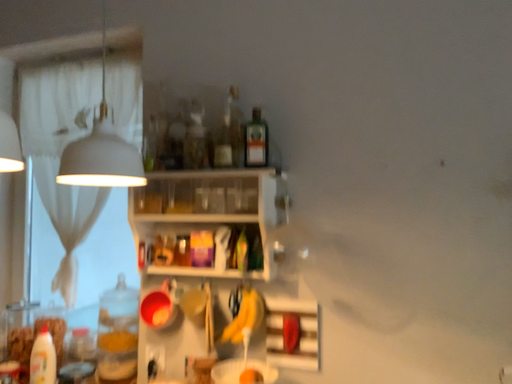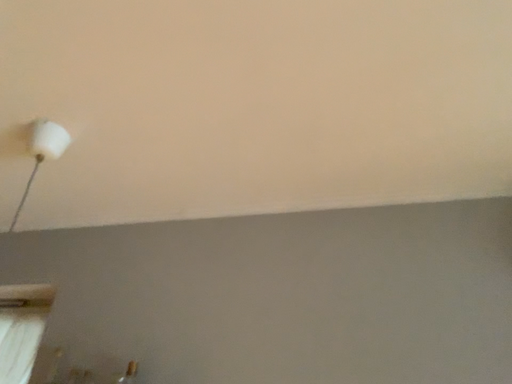
Question: How did the camera likely rotate when shooting the video?

Choices:
 (A) rotated downward
 (B) rotated upward

Answer: (B)